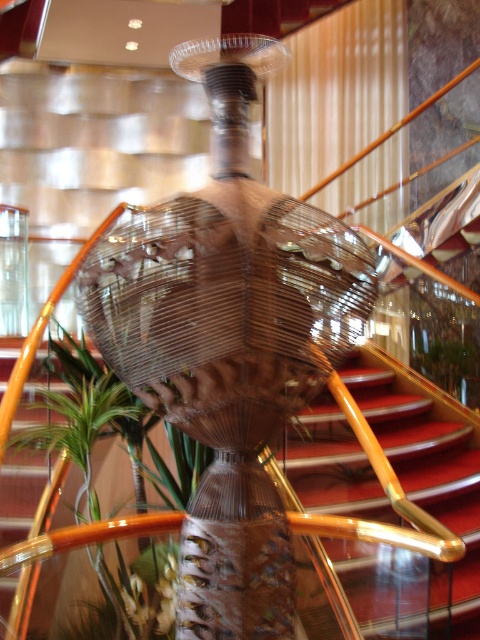
Is point (294, 349) positioned before point (303, 465)?

Yes.

Does brown woven basket at center appear on the left side of red carpeted stairs at center?

Indeed, brown woven basket at center is positioned on the left side of red carpeted stairs at center.

Who is more distant from viewer, (x=332, y=326) or (x=433, y=515)?

The point (x=433, y=515) is behind.

Locate an element on the screen. The width and height of the screenshot is (480, 640). brown woven basket at center is located at coordinates (228, 340).

Is point (368, 477) positioned before point (202, 467)?

That is False.

Is shiny red carpet at center wider than green leafy plant at center?

Yes.

I want to click on shiny red carpet at center, so click(420, 433).

This screenshot has height=640, width=480. In order to click on shiny red carpet at center in this screenshot , I will do `click(420, 433)`.

Who is shorter, brown woven basket at center or shiny red carpet at center?

shiny red carpet at center is shorter.

Between brown woven basket at center and shiny red carpet at center, which one appears on the right side from the viewer's perspective?

Positioned to the right is shiny red carpet at center.

Does point (333, 330) lie in front of point (444, 467)?

That is True.

I want to click on brown woven basket at center, so click(x=228, y=340).